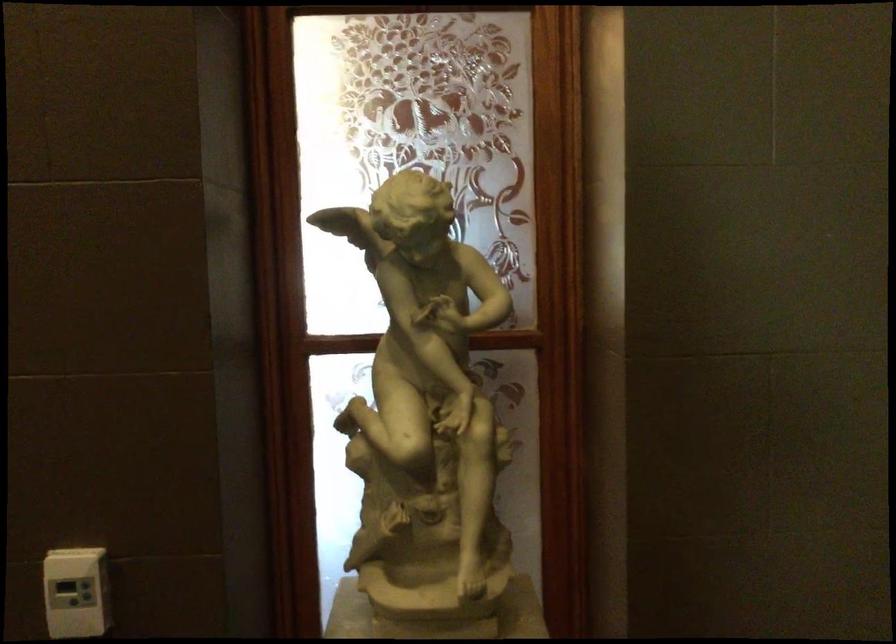
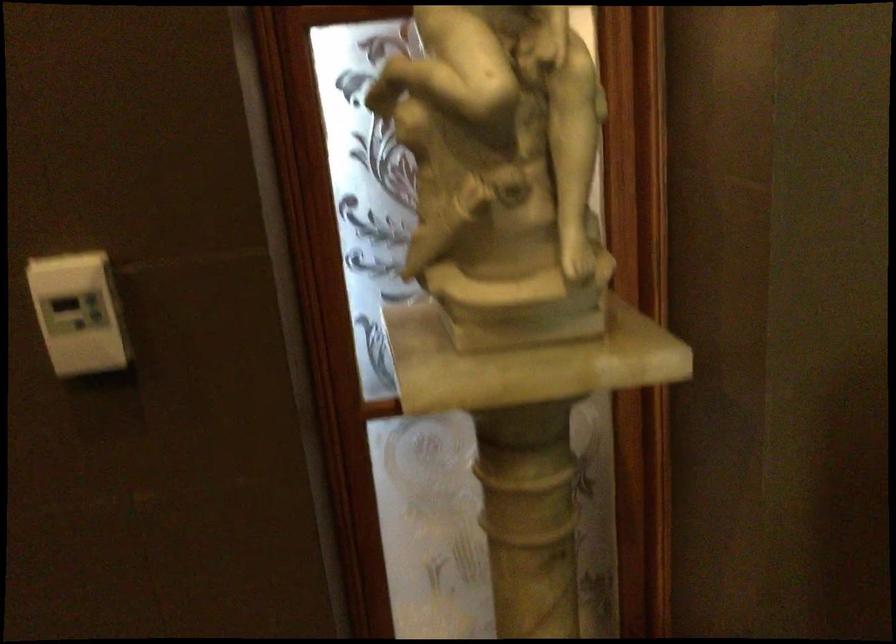
Question: Based on the continuous images, in which direction is the camera rotating? Reply with the corresponding letter.

Choices:
 (A) Left
 (B) Right
 (C) Up
 (D) Down

Answer: (D)